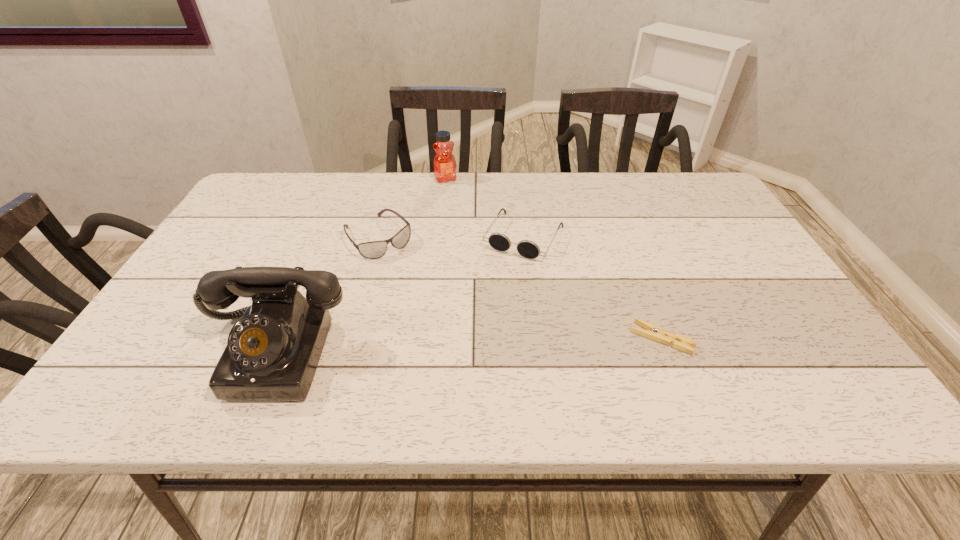
Where is `free space that satisfies the following two spatial constraints: 1. on the front side of the third object from left to right; 2. on the left side of the rightmost object`? This screenshot has width=960, height=540. free space that satisfies the following two spatial constraints: 1. on the front side of the third object from left to right; 2. on the left side of the rightmost object is located at coordinates (428, 339).

Image resolution: width=960 pixels, height=540 pixels. Identify the location of vacant space that satisfies the following two spatial constraints: 1. on the front side of the third object from left to right; 2. on the left side of the right sunglasses. (439, 237).